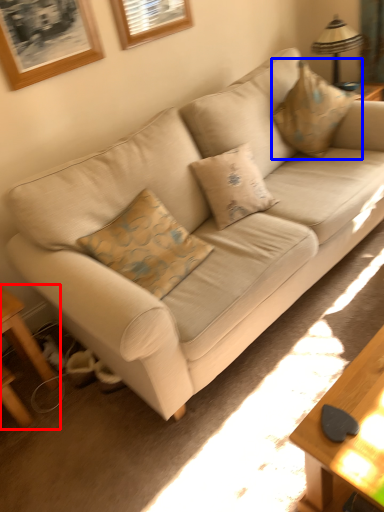
Question: Which of the following is the closest to the observer, table (highlighted by a red box) or throw pillow (highlighted by a blue box)?

Choices:
 (A) table
 (B) throw pillow

Answer: (A)